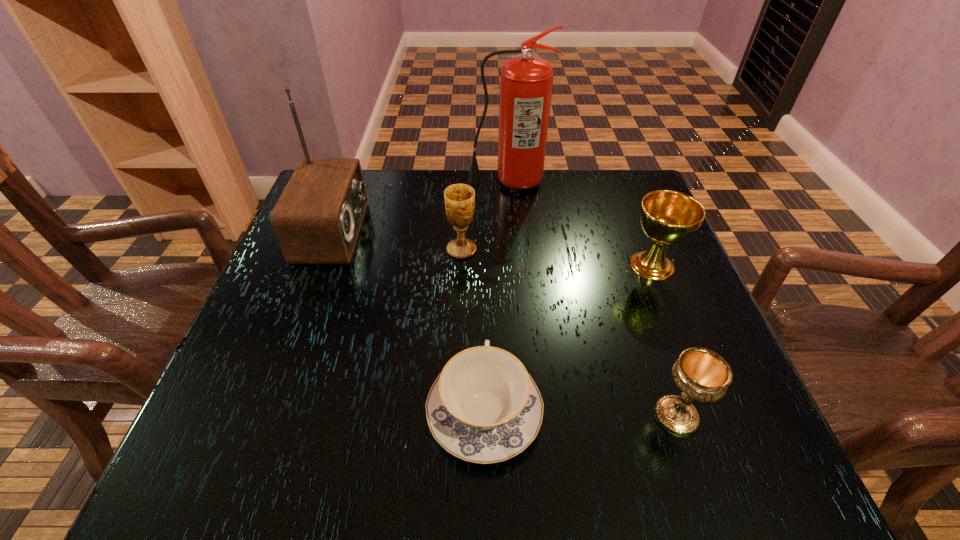
The height and width of the screenshot is (540, 960). I want to click on the tallest object, so click(526, 83).

You are a GUI agent. You are given a task and a screenshot of the screen. Output one action in this format:
    pyautogui.click(x=<x>, y=<y>)
    Task: Click on the fire extinguisher
    The height and width of the screenshot is (540, 960).
    Given the screenshot: What is the action you would take?
    pyautogui.click(x=526, y=83)

At what (x,y) coordinates should I click in order to perform the action: click on the leftmost object. Please return your answer as a coordinate pair (x, y). Looking at the image, I should click on (317, 219).

Locate an element on the screen. The height and width of the screenshot is (540, 960). the second tallest object is located at coordinates (317, 219).

Identify the location of the leftmost chalice. (459, 199).

You are a GUI agent. You are given a task and a screenshot of the screen. Output one action in this format:
    pyautogui.click(x=<x>, y=<y>)
    Task: Click on the nearest chalice
    This screenshot has width=960, height=540.
    Given the screenshot: What is the action you would take?
    pyautogui.click(x=701, y=374)

Where is `chinaware`? This screenshot has height=540, width=960. chinaware is located at coordinates (484, 407).

The height and width of the screenshot is (540, 960). Find the location of `vacant space located on the instruction side of the farthest object`. vacant space located on the instruction side of the farthest object is located at coordinates pos(513,235).

Find the location of a particular element. The image size is (960, 540). free space located on the front-facing side of the leftmost object is located at coordinates (482, 232).

Find the location of a particular element. The image size is (960, 540). blank area located 0.230m on the back of the leftmost chalice is located at coordinates (465, 185).